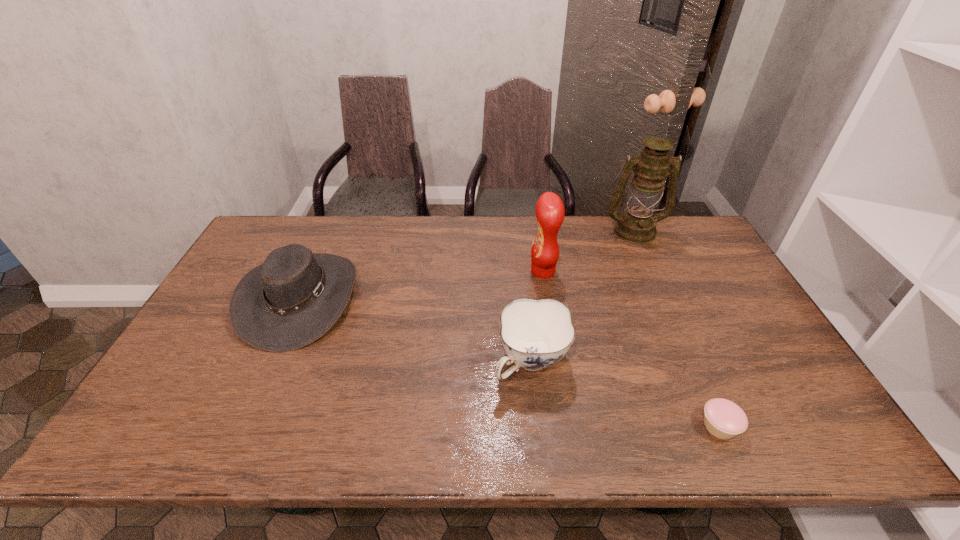
Identify the location of free space located on the label side of the second tallest object. The image size is (960, 540). (498, 271).

Where is `vacant area located on the front-facing side of the cowboy hat`? This screenshot has height=540, width=960. vacant area located on the front-facing side of the cowboy hat is located at coordinates (421, 299).

Locate an element on the screen. The image size is (960, 540). free spot located on the right of the chinaware is located at coordinates (636, 362).

You are a GUI agent. You are given a task and a screenshot of the screen. Output one action in this format:
    pyautogui.click(x=<x>, y=<y>)
    Task: Click on the free location located 0.180m on the left of the shortest object
    
    Given the screenshot: What is the action you would take?
    pyautogui.click(x=619, y=427)

Locate an element on the screen. The width and height of the screenshot is (960, 540). oil lamp present at the far edge is located at coordinates (637, 225).

At what (x,y) coordinates should I click in order to perform the action: click on cowboy hat that is at the far edge. Please return your answer as a coordinate pair (x, y). Looking at the image, I should click on (x=291, y=300).

This screenshot has width=960, height=540. Identify the location of object that is at the near edge. (724, 419).

I want to click on object situated at the left edge, so click(291, 300).

Locate an element on the screen. The width and height of the screenshot is (960, 540). object at the right edge is located at coordinates (637, 225).

Find the location of a particular element. The width and height of the screenshot is (960, 540). object at the far left corner is located at coordinates (291, 300).